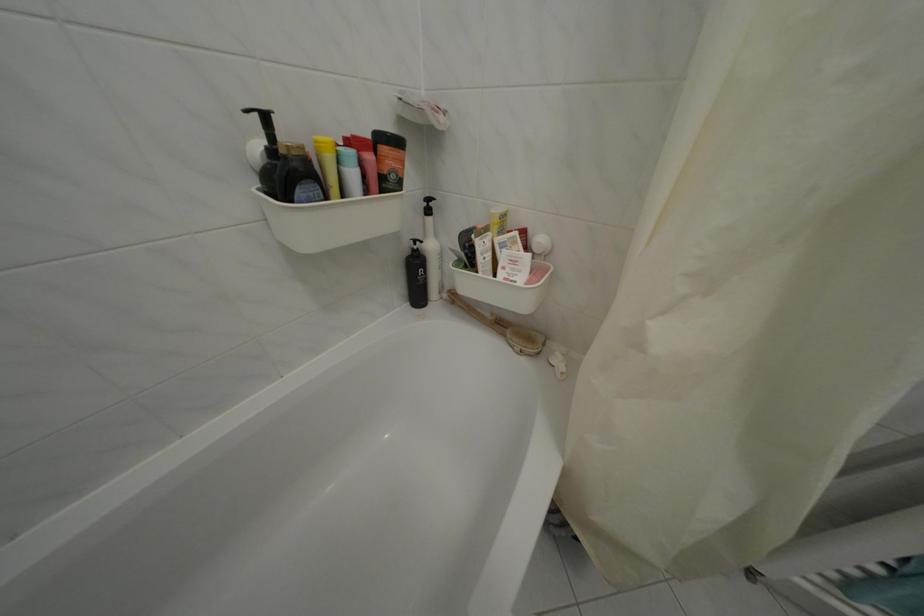
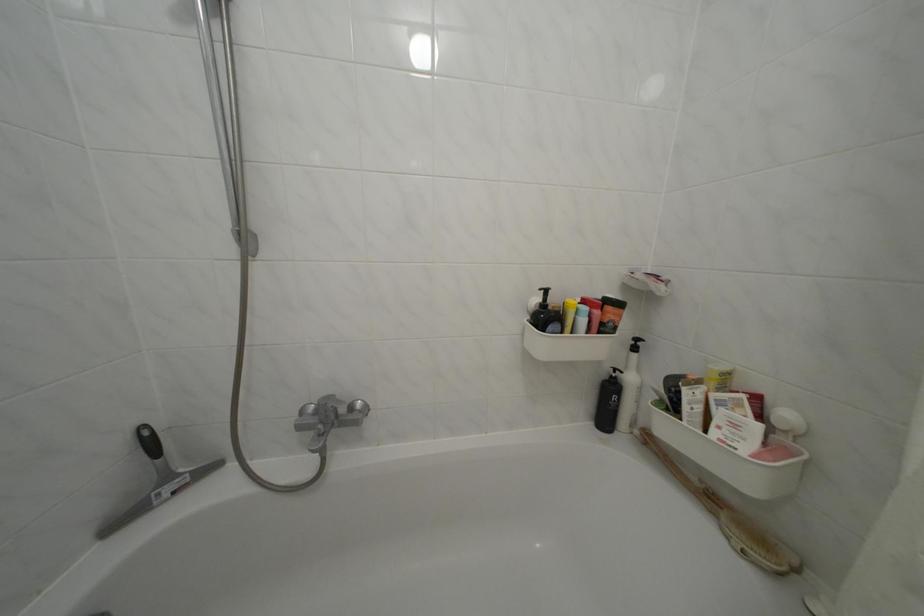
Where in the second image is the point corresponding to (290,156) from the first image?

(560, 314)